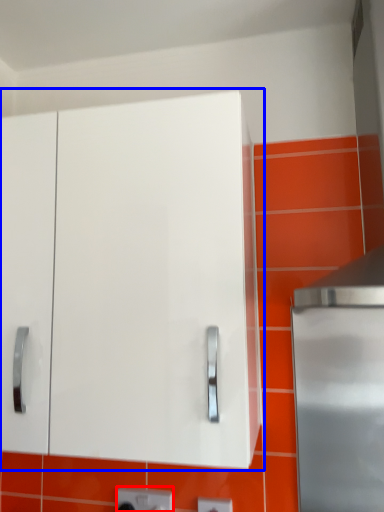
Question: Which object is closer to the camera taking this photo, electric outlet (highlighted by a red box) or cabinetry (highlighted by a blue box)?

Choices:
 (A) electric outlet
 (B) cabinetry

Answer: (B)